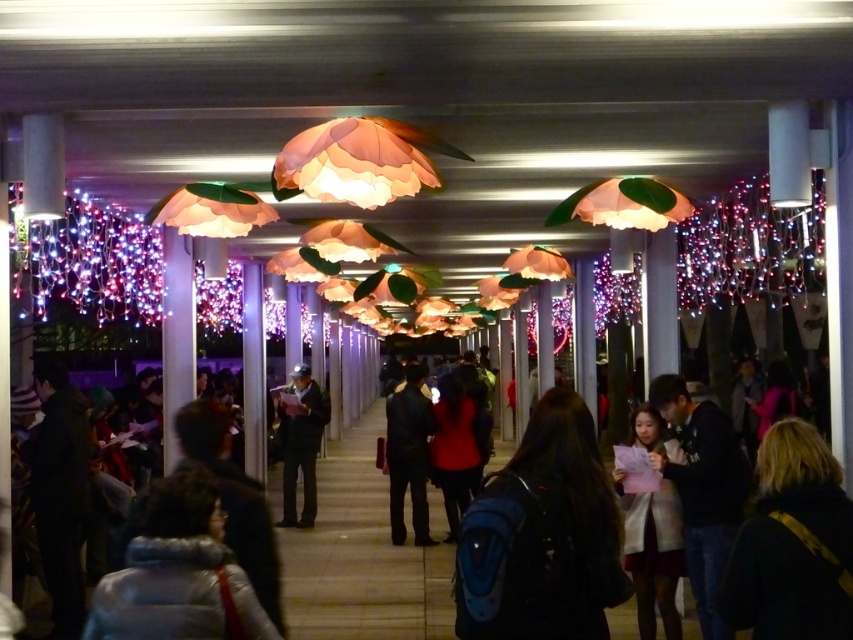
In the scene shown: You are standing in the corridor and want to take a photo of the blue backpack at center. The camera you have is 9.42 feet away from the backpack. Is the distance within the camera lens range of 10 feet? Please answer yes or no.

Yes, the blue backpack at center and camera are 9.42 feet apart, which is within the camera lens range of 10 feet.

You are a photographer standing in the corridor and want to capture a photo of the blonde hair at center and the white matte coat at center. Based on their heights, which one should you adjust your camera angle to focus on first if you want to include both in the frame without moving the camera?

The blonde hair at center is shorter than the white matte coat at center, so you should focus on the blonde hair at center first to ensure it is in frame before the taller white matte coat at center blocks it.

You are standing in the corridor and want to take a photo. There are two points marked in the image, point 1 at coordinates point [497,506] and point 2 at coordinates point [701,486]. Which point will appear larger in your photo?

Point [497,506] is closer to the camera than point [701,486], so it will appear larger in the photo.